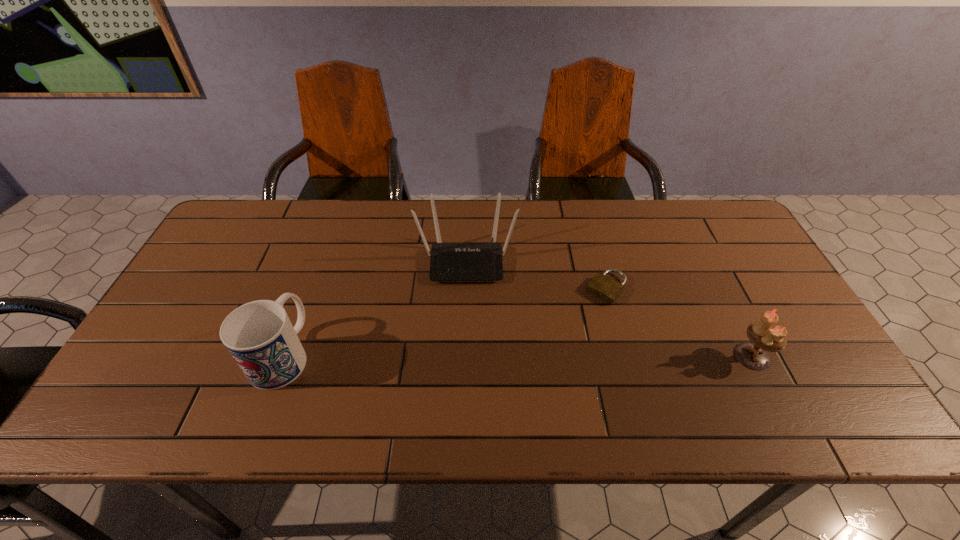
You are a GUI agent. You are given a task and a screenshot of the screen. Output one action in this format:
    pyautogui.click(x=<x>, y=<y>)
    Task: Click on the free spot on the desktop that is between the mug and the candle holder and is positioned on the keyhole side of the second object from right to left
    
    Given the screenshot: What is the action you would take?
    pyautogui.click(x=546, y=355)

Image resolution: width=960 pixels, height=540 pixels. Identify the location of free space on the desktop that is between the leftmost object and the candle holder and is positioned on the front-facing side of the router. (466, 355).